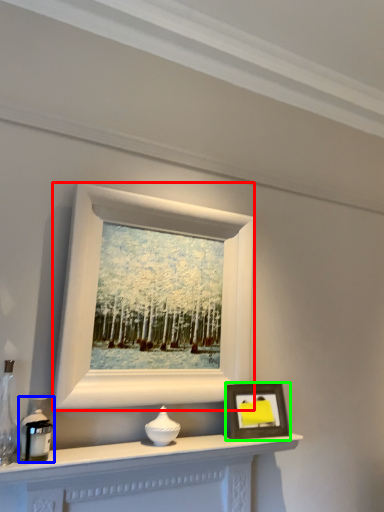
Question: Which is nearer to the picture frame (highlighted by a red box)? candle holder (highlighted by a blue box) or picture frame (highlighted by a green box).

Choices:
 (A) candle holder
 (B) picture frame

Answer: (B)